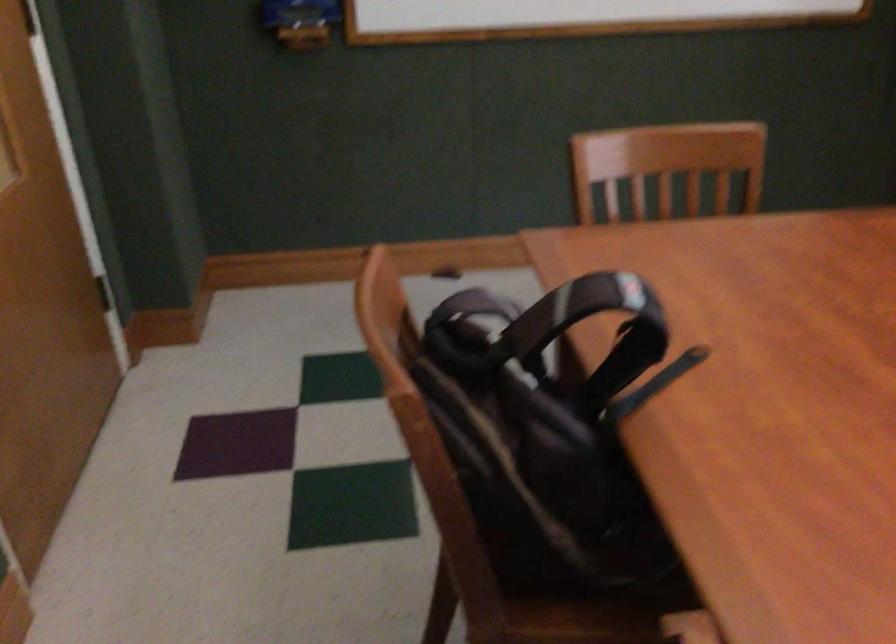
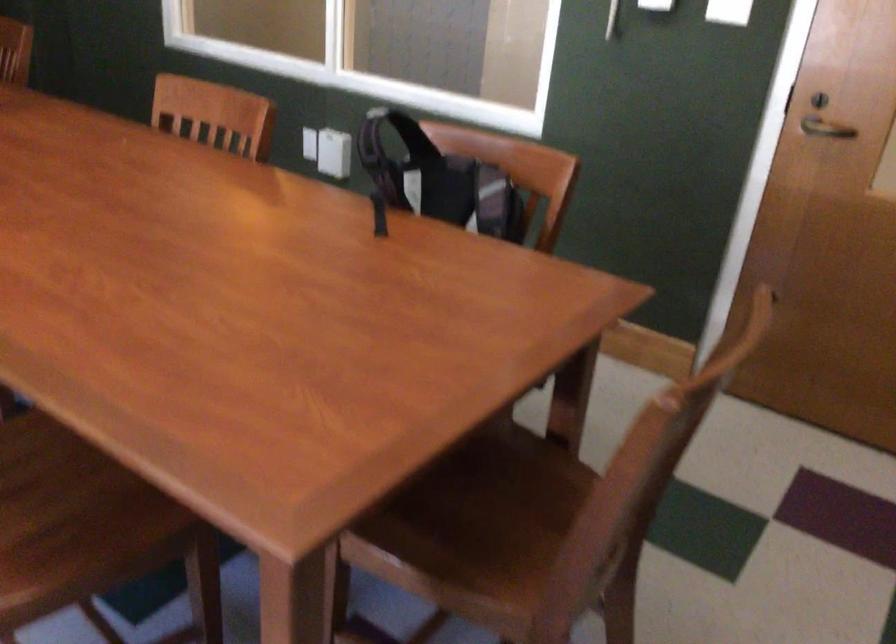
Find the pixel in the second image that matches point (503, 364) in the first image.

(438, 180)